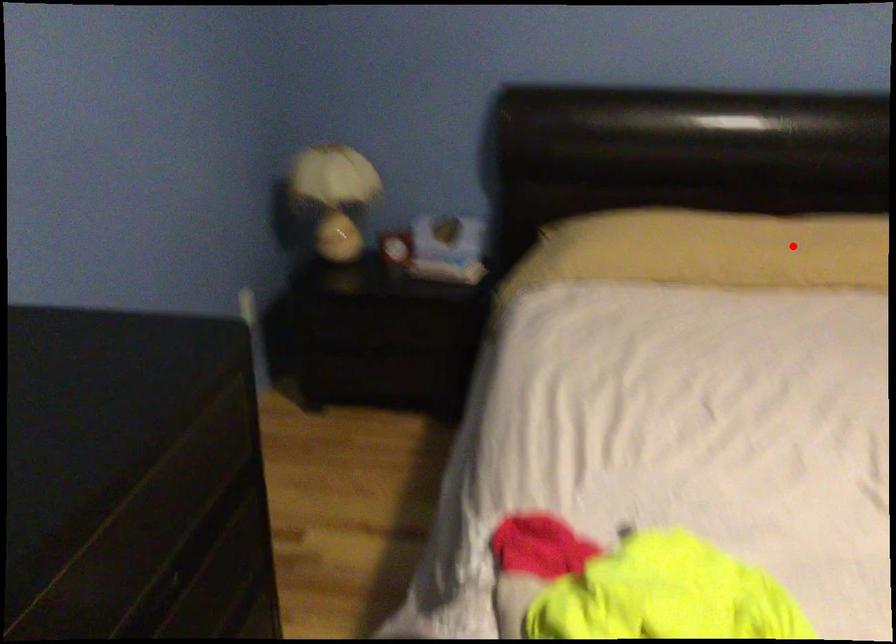
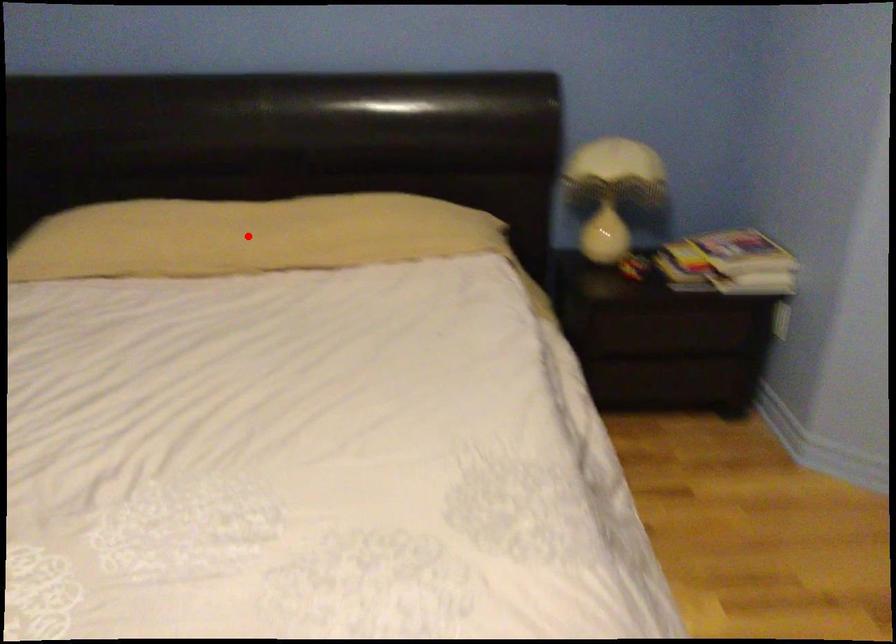
I am providing you with two images of the same scene from different viewpoints. A red point is marked on the first image and another point is marked on the second image. Does the point marked in image1 correspond to the same location as the one in image2?

Yes